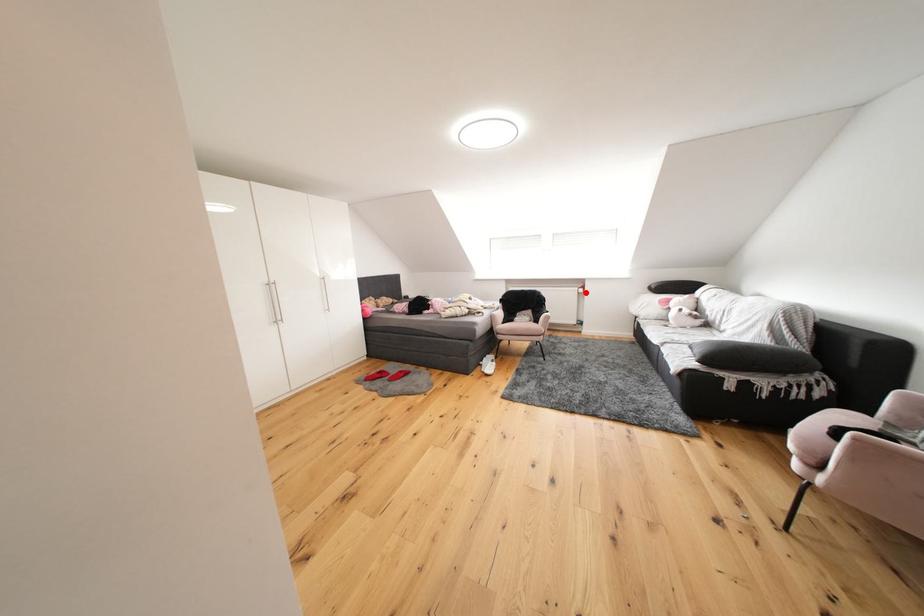
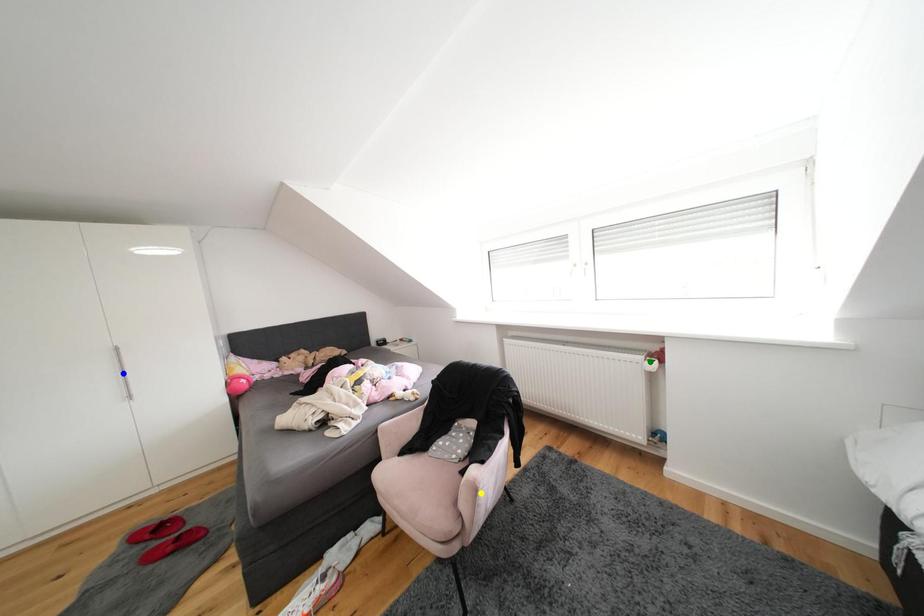
Question: I am providing you with two images of the same scene from different viewpoints. A red point is marked on the first image. You are given multiple points on the second image. Which point in image 2 is actually the same real-world point as the red point in image 1?

Choices:
 (A) blue point
 (B) yellow point
 (C) green point

Answer: (C)